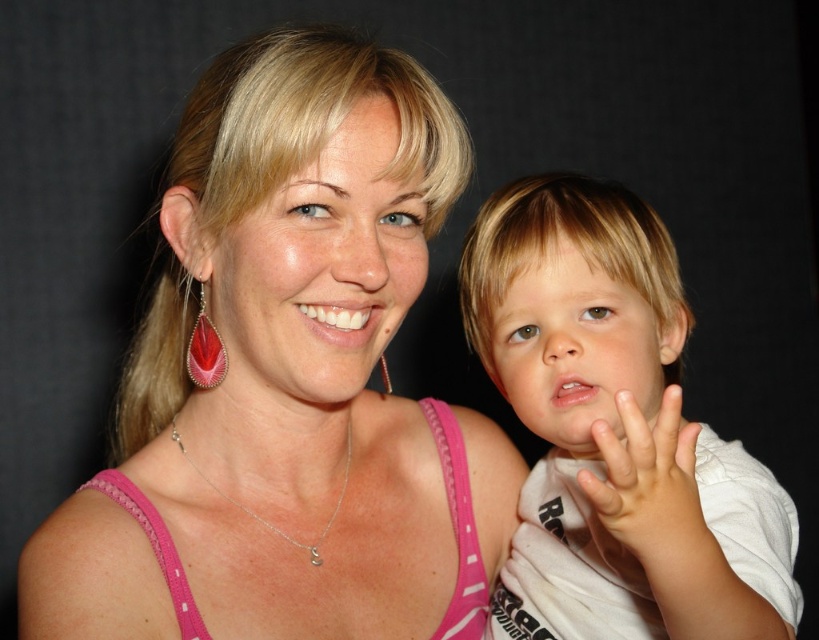
Question: In this image, where is teardrop-shaped red gemstone earring at left located relative to silver chain at center?

Choices:
 (A) left
 (B) right

Answer: (A)

Question: Which point appears farthest from the camera in this image?

Choices:
 (A) (147, 611)
 (B) (654, 484)
 (C) (215, 384)
 (D) (604, 192)

Answer: (D)

Question: Is pink fabric tank top at center above silver chain at center?

Choices:
 (A) no
 (B) yes

Answer: (B)

Question: Among these objects, which one is farthest from the camera?

Choices:
 (A) silver chain at center
 (B) pale skin/soft flesh hand at center

Answer: (A)

Question: Which point is farther to the camera?

Choices:
 (A) pink fabric tank top at center
 (B) silver chain at center
 (C) pale skin/soft flesh hand at center
 (D) teardrop-shaped red gemstone earring at left

Answer: (B)

Question: Can you confirm if pale skin/soft flesh hand at center is positioned above teardrop-shaped red gemstone earring at left?

Choices:
 (A) no
 (B) yes

Answer: (A)